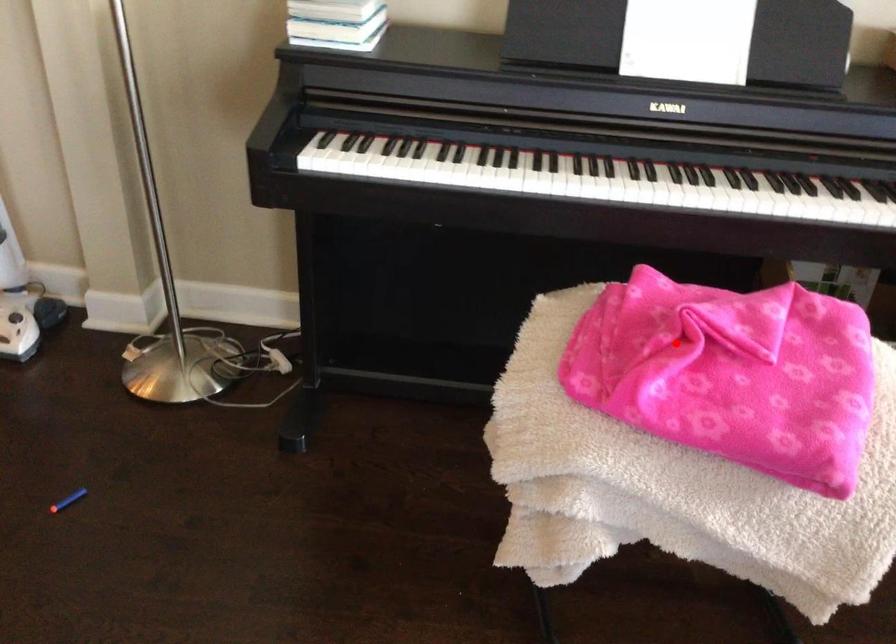
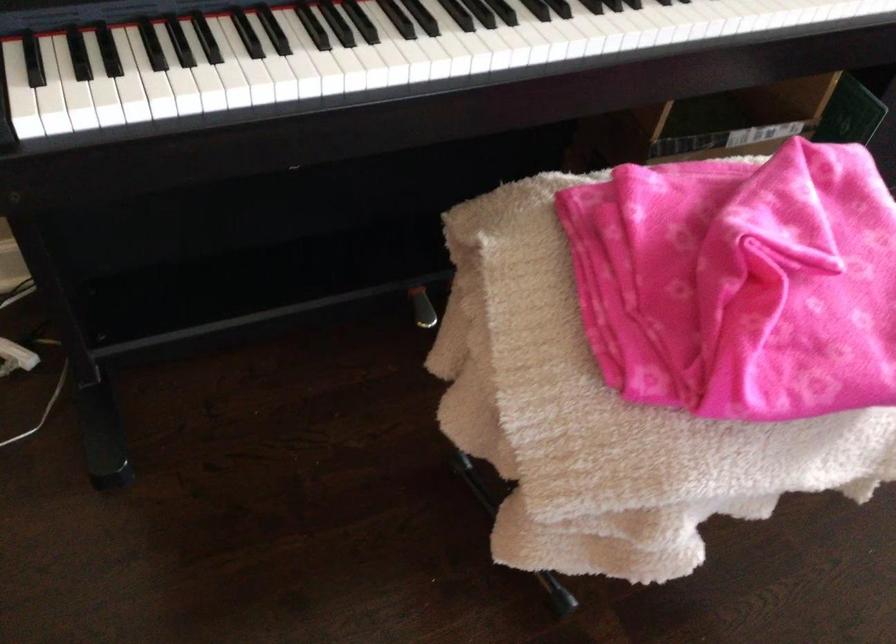
Question: I am providing you with two images of the same scene from different viewpoints. Image1 has a red point marked. In image2, the corresponding 3D location appears at what relative position? Reply with the corresponding letter.

Choices:
 (A) Closer
 (B) Farther

Answer: (A)